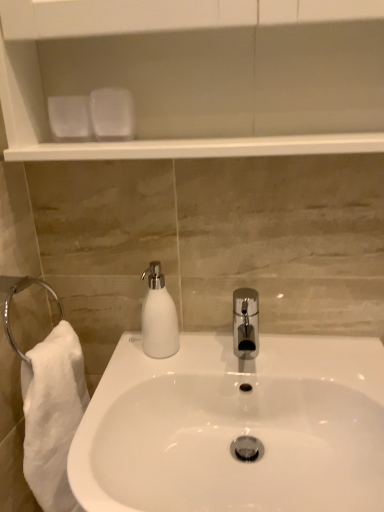
Question: Is white matte soap dispenser at center to the left or to the right of white glossy sink at center in the image?

Choices:
 (A) left
 (B) right

Answer: (A)

Question: Is white matte soap dispenser at center spatially inside white glossy sink at center, or outside of it?

Choices:
 (A) outside
 (B) inside

Answer: (A)

Question: Looking at the image, does white matte soap dispenser at center seem bigger or smaller compared to white glossy sink at center?

Choices:
 (A) small
 (B) big

Answer: (A)

Question: Would you say white glossy sink at center is inside or outside white matte soap dispenser at center?

Choices:
 (A) inside
 (B) outside

Answer: (B)

Question: Is point (180, 394) positioned closer to the camera than point (157, 266)?

Choices:
 (A) closer
 (B) farther

Answer: (A)

Question: Is white glossy sink at center bigger or smaller than white matte soap dispenser at center?

Choices:
 (A) big
 (B) small

Answer: (A)

Question: In the image, is white glossy sink at center positioned in front of or behind white matte soap dispenser at center?

Choices:
 (A) front
 (B) behind

Answer: (A)